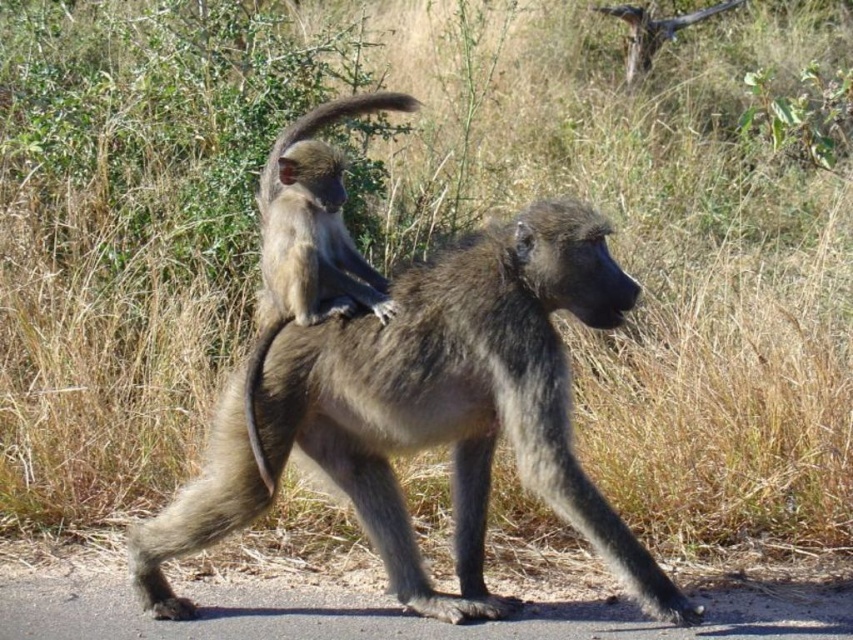
Which of these two, gray furry monkey at center or fuzzy gray tail at center, stands shorter?

With less height is fuzzy gray tail at center.

Between point (396, 392) and point (260, 468), which one is positioned behind?

The point (260, 468) is behind.

In order to click on gray furry monkey at center in this screenshot , I will do `click(462, 397)`.

From the picture: Measure the distance between gray furry monkey at upper center and camera.

The distance of gray furry monkey at upper center from camera is 4.00 meters.

Who is positioned more to the right, gray furry monkey at upper center or fuzzy gray tail at center?

Positioned to the right is gray furry monkey at upper center.

Find the location of a particular element. gray furry monkey at upper center is located at coordinates (316, 221).

This screenshot has height=640, width=853. In order to click on gray furry monkey at upper center in this screenshot , I will do `click(316, 221)`.

Does gray furry monkey at center come in front of gray furry monkey at upper center?

Yes, it is.

Does gray furry monkey at center have a lesser height compared to gray furry monkey at upper center?

No.

Who is more forward, (553, 285) or (265, 259)?

Point (553, 285)

I want to click on gray furry monkey at center, so click(462, 397).